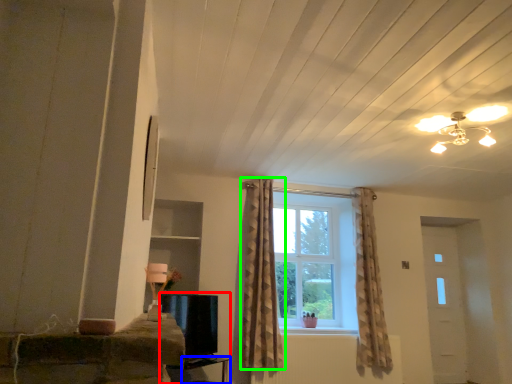
Question: Based on their relative distances, which object is farther from entertainment center (highlighted by a red box)? Choose from table (highlighted by a blue box) and curtain (highlighted by a green box).

Choices:
 (A) table
 (B) curtain

Answer: (B)